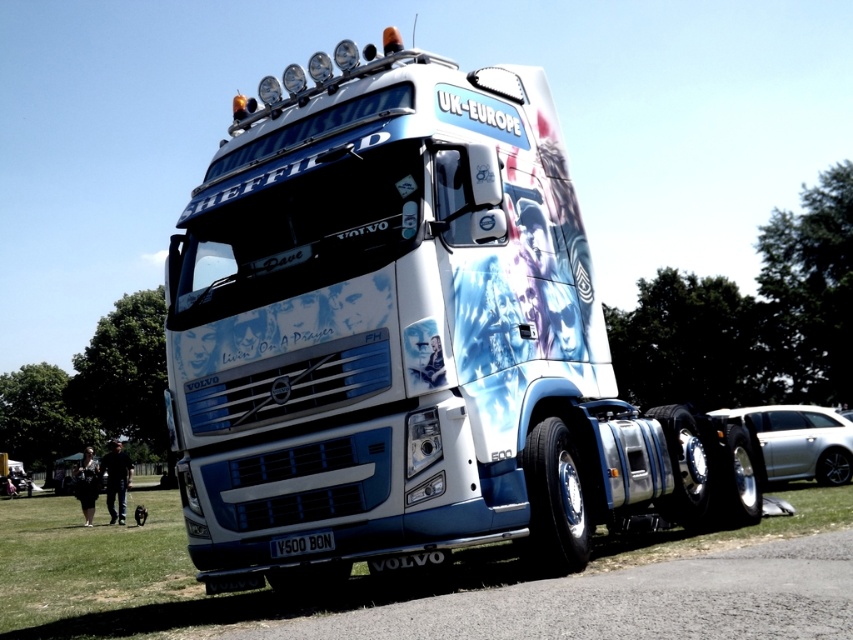
Question: Does white glossy truck at center have a smaller size compared to green grass at lower left?

Choices:
 (A) yes
 (B) no

Answer: (A)

Question: Which is farther from the green grass at lower left?

Choices:
 (A) white glossy truck at center
 (B) silver metallic car at lower right

Answer: (B)

Question: Which object is positioned closest to the white glossy truck at center?

Choices:
 (A) silver metallic car at lower right
 (B) black metallic license plate at bottom

Answer: (B)

Question: Is the position of white glossy truck at center less distant than that of black metallic license plate at bottom?

Choices:
 (A) no
 (B) yes

Answer: (B)

Question: Is green grass at lower left to the left of silver metallic car at lower right from the viewer's perspective?

Choices:
 (A) yes
 (B) no

Answer: (A)

Question: Which point is farther to the camera?

Choices:
 (A) (164, 611)
 (B) (294, 536)
 (C) (526, 339)

Answer: (A)